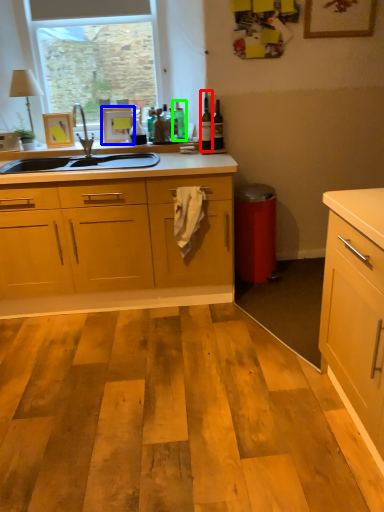
Question: Based on their relative distances, which object is nearer to bottle (highlighted by a red box)? Choose from picture frame (highlighted by a blue box) and bottle (highlighted by a green box).

Choices:
 (A) picture frame
 (B) bottle

Answer: (B)